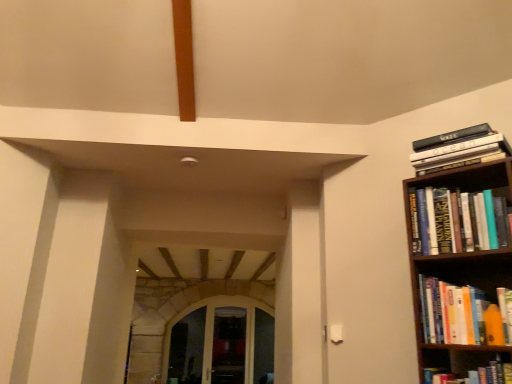
Where is `hardcover book at upper right, the second book in the top-to-bottom sequence`? Image resolution: width=512 pixels, height=384 pixels. hardcover book at upper right, the second book in the top-to-bottom sequence is located at coordinates (456, 221).

Image resolution: width=512 pixels, height=384 pixels. Describe the element at coordinates (456, 221) in the screenshot. I see `hardcover book at upper right, the second book in the top-to-bottom sequence` at that location.

Identify the location of clear glass door at center, which is the 2th glass door in right-to-left order. This screenshot has height=384, width=512. (212, 330).

The width and height of the screenshot is (512, 384). What do you see at coordinates (473, 375) in the screenshot?
I see `hardcover book at right, which is counted as the fourth book, starting from the top` at bounding box center [473, 375].

Where is `hardcover book at upper right, the second book in the top-to-bottom sequence`? The height and width of the screenshot is (384, 512). hardcover book at upper right, the second book in the top-to-bottom sequence is located at coordinates (456, 221).

This screenshot has height=384, width=512. Identify the location of the 1st book below the hardcover books at upper right, marked as the 4th book in a bottom-to-top arrangement (from the image's perspective). (456, 221).

Between hardcover book at upper right, which ranks as the 3th book in bottom-to-top order, and hardcover books at upper right, marked as the 4th book in a bottom-to-top arrangement, which one has larger size?

With larger size is hardcover books at upper right, marked as the 4th book in a bottom-to-top arrangement.

Is hardcover book at upper right, which ranks as the 3th book in bottom-to-top order, thinner than hardcover books at upper right, marked as the 4th book in a bottom-to-top arrangement?

Indeed, hardcover book at upper right, which ranks as the 3th book in bottom-to-top order, has a lesser width compared to hardcover books at upper right, marked as the 4th book in a bottom-to-top arrangement.

Are hardcover book at upper right, the second book in the top-to-bottom sequence, and hardcover books at upper right, positioned as the 1th book in top-to-bottom order, far apart?

No, there isn't a large distance between hardcover book at upper right, the second book in the top-to-bottom sequence, and hardcover books at upper right, positioned as the 1th book in top-to-bottom order.

Can you confirm if hardcover book at upper right, the second book in the top-to-bottom sequence, is shorter than hardcover book at right, which is counted as the fourth book, starting from the top?

In fact, hardcover book at upper right, the second book in the top-to-bottom sequence, may be taller than hardcover book at right, which is counted as the fourth book, starting from the top.

Relative to hardcover book at right, which is counted as the fourth book, starting from the top, is hardcover book at upper right, the second book in the top-to-bottom sequence, in front or behind?

Visually, hardcover book at upper right, the second book in the top-to-bottom sequence, is located behind hardcover book at right, which is counted as the fourth book, starting from the top.

Is hardcover book at upper right, the second book in the top-to-bottom sequence, facing towards hardcover book at right, arranged as the first book when ordered from the bottom?

No.

In the scene shown: Does hardcover books at upper right, positioned as the 1th book in top-to-bottom order, have a lesser width compared to transparent glass door at center, acting as the first glass door starting from the right?

No, hardcover books at upper right, positioned as the 1th book in top-to-bottom order, is not thinner than transparent glass door at center, acting as the first glass door starting from the right.

Looking at this image, considering the sizes of objects hardcover books at upper right, positioned as the 1th book in top-to-bottom order, and transparent glass door at center, which ranks as the second glass door in left-to-right order, in the image provided, who is bigger, hardcover books at upper right, positioned as the 1th book in top-to-bottom order, or transparent glass door at center, which ranks as the second glass door in left-to-right order,?

transparent glass door at center, which ranks as the second glass door in left-to-right order, is bigger.

From a real-world perspective, is hardcover books at upper right, marked as the 4th book in a bottom-to-top arrangement, positioned over transparent glass door at center, which ranks as the second glass door in left-to-right order, based on gravity?

Correct, in the physical world, hardcover books at upper right, marked as the 4th book in a bottom-to-top arrangement, is higher than transparent glass door at center, which ranks as the second glass door in left-to-right order.

From the image's perspective, is hardcover books at upper right, positioned as the 1th book in top-to-bottom order, on transparent glass door at center, which ranks as the second glass door in left-to-right order?

Yes, from the image's perspective, hardcover books at upper right, positioned as the 1th book in top-to-bottom order, is over transparent glass door at center, which ranks as the second glass door in left-to-right order.

Could you tell me if orange matte bookshelf at right, the 2th book ordered from the bottom, is facing hardcover book at upper right, which ranks as the 3th book in bottom-to-top order?

No, orange matte bookshelf at right, the 2th book ordered from the bottom, is not oriented towards hardcover book at upper right, which ranks as the 3th book in bottom-to-top order.

Which object is further away from the camera taking this photo, orange matte bookshelf at right, the 2th book ordered from the bottom, or hardcover book at upper right, which ranks as the 3th book in bottom-to-top order?

hardcover book at upper right, which ranks as the 3th book in bottom-to-top order, is further from the camera.

Find the location of `the 1st book positioned above the orange matte bookshelf at right, which is the 3th book in top-to-bottom order (from a real-world perspective)`. the 1st book positioned above the orange matte bookshelf at right, which is the 3th book in top-to-bottom order (from a real-world perspective) is located at coordinates point(456,221).

Which is correct: orange matte bookshelf at right, which is the 3th book in top-to-bottom order, is inside hardcover book at upper right, which ranks as the 3th book in bottom-to-top order, or outside of it?

orange matte bookshelf at right, which is the 3th book in top-to-bottom order, exists outside the volume of hardcover book at upper right, which ranks as the 3th book in bottom-to-top order.

Is clear glass door at center, which is the 2th glass door in right-to-left order, further to the viewer compared to orange matte bookshelf at right, which is the 3th book in top-to-bottom order?

Yes.

Is point (164, 382) farther from viewer compared to point (439, 325)?

Yes, it is.

Which of these two, clear glass door at center, the first glass door positioned from the left, or orange matte bookshelf at right, the 2th book ordered from the bottom, is bigger?

clear glass door at center, the first glass door positioned from the left, is bigger.

Is clear glass door at center, which is the 2th glass door in right-to-left order, aimed at orange matte bookshelf at right, which is the 3th book in top-to-bottom order?

Yes, clear glass door at center, which is the 2th glass door in right-to-left order, is turned towards orange matte bookshelf at right, which is the 3th book in top-to-bottom order.

Considering the relative positions of orange matte bookshelf at right, which is the 3th book in top-to-bottom order, and hardcover book at right, which is counted as the fourth book, starting from the top, in the image provided, is orange matte bookshelf at right, which is the 3th book in top-to-bottom order, to the left or to the right of hardcover book at right, which is counted as the fourth book, starting from the top,?

orange matte bookshelf at right, which is the 3th book in top-to-bottom order, is positioned on hardcover book at right, which is counted as the fourth book, starting from the top,'s right side.

From a real-world perspective, is orange matte bookshelf at right, which is the 3th book in top-to-bottom order, physically above hardcover book at right, arranged as the first book when ordered from the bottom?

Yes.

Would you say orange matte bookshelf at right, which is the 3th book in top-to-bottom order, is outside hardcover book at right, arranged as the first book when ordered from the bottom?

Yes, orange matte bookshelf at right, which is the 3th book in top-to-bottom order, is not within hardcover book at right, arranged as the first book when ordered from the bottom.

What's the angular difference between orange matte bookshelf at right, which is the 3th book in top-to-bottom order, and hardcover book at right, arranged as the first book when ordered from the bottom,'s facing directions?

2.74 degrees.

Does point (251, 302) lie behind point (428, 373)?

Yes, it is.

Is clear glass door at center, the first glass door positioned from the left, wider or thinner than hardcover book at right, which is counted as the fourth book, starting from the top?

Considering their sizes, clear glass door at center, the first glass door positioned from the left, looks slimmer than hardcover book at right, which is counted as the fourth book, starting from the top.

Considering the positions of objects clear glass door at center, the first glass door positioned from the left, and hardcover book at right, arranged as the first book when ordered from the bottom, in the image provided, who is more to the right, clear glass door at center, the first glass door positioned from the left, or hardcover book at right, arranged as the first book when ordered from the bottom,?

hardcover book at right, arranged as the first book when ordered from the bottom, is more to the right.

From the image's perspective, is clear glass door at center, the first glass door positioned from the left, on hardcover book at right, which is counted as the fourth book, starting from the top?

No, from the image's perspective, clear glass door at center, the first glass door positioned from the left, is not above hardcover book at right, which is counted as the fourth book, starting from the top.

Identify the location of the 1st book below the hardcover books at upper right, marked as the 4th book in a bottom-to-top arrangement (from the image's perspective). (x=456, y=221).

This screenshot has width=512, height=384. There is a hardcover book at right, arranged as the first book when ordered from the bottom. Find the location of `the 2nd book above it (from a real-world perspective)`. the 2nd book above it (from a real-world perspective) is located at coordinates (456, 221).

From the image, which object appears to be nearer to clear glass door at center, the first glass door positioned from the left, transparent glass door at center, which ranks as the second glass door in left-to-right order, or hardcover book at right, which is counted as the fourth book, starting from the top?

transparent glass door at center, which ranks as the second glass door in left-to-right order, is closer to clear glass door at center, the first glass door positioned from the left.

Looking at this image, when comparing their distances from hardcover book at right, arranged as the first book when ordered from the bottom, does hardcover books at upper right, positioned as the 1th book in top-to-bottom order, or clear glass door at center, the first glass door positioned from the left, seem further?

clear glass door at center, the first glass door positioned from the left.

Considering their positions, is hardcover book at upper right, the second book in the top-to-bottom sequence, positioned further to transparent glass door at center, which ranks as the second glass door in left-to-right order, than hardcover book at right, which is counted as the fourth book, starting from the top?

hardcover book at upper right, the second book in the top-to-bottom sequence, lies further to transparent glass door at center, which ranks as the second glass door in left-to-right order, than the other object.

When comparing their distances from hardcover book at right, arranged as the first book when ordered from the bottom, does hardcover book at upper right, which ranks as the 3th book in bottom-to-top order, or hardcover books at upper right, positioned as the 1th book in top-to-bottom order, seem closer?

Based on the image, hardcover book at upper right, which ranks as the 3th book in bottom-to-top order, appears to be nearer to hardcover book at right, arranged as the first book when ordered from the bottom.

Looking at the image, which one is located closer to hardcover book at upper right, the second book in the top-to-bottom sequence, clear glass door at center, the first glass door positioned from the left, or hardcover books at upper right, marked as the 4th book in a bottom-to-top arrangement?

Based on the image, hardcover books at upper right, marked as the 4th book in a bottom-to-top arrangement, appears to be nearer to hardcover book at upper right, the second book in the top-to-bottom sequence.

Considering their positions, is orange matte bookshelf at right, the 2th book ordered from the bottom, positioned closer to clear glass door at center, the first glass door positioned from the left, than hardcover books at upper right, marked as the 4th book in a bottom-to-top arrangement?

orange matte bookshelf at right, the 2th book ordered from the bottom.

Based on their spatial positions, is clear glass door at center, which is the 2th glass door in right-to-left order, or hardcover book at upper right, which ranks as the 3th book in bottom-to-top order, further from orange matte bookshelf at right, which is the 3th book in top-to-bottom order?

Based on the image, clear glass door at center, which is the 2th glass door in right-to-left order, appears to be further to orange matte bookshelf at right, which is the 3th book in top-to-bottom order.

Based on their spatial positions, is hardcover book at upper right, the second book in the top-to-bottom sequence, or hardcover books at upper right, positioned as the 1th book in top-to-bottom order, further from clear glass door at center, which is the 2th glass door in right-to-left order?

hardcover books at upper right, positioned as the 1th book in top-to-bottom order, is positioned further to the anchor clear glass door at center, which is the 2th glass door in right-to-left order.

The width and height of the screenshot is (512, 384). Identify the location of book between hardcover book at upper right, which ranks as the 3th book in bottom-to-top order, and clear glass door at center, the first glass door positioned from the left, along the z-axis. (462, 150).

In order to click on glass door located between hardcover book at upper right, which ranks as the 3th book in bottom-to-top order, and transparent glass door at center, which ranks as the second glass door in left-to-right order, in the depth direction in this screenshot , I will do `click(212, 330)`.

At what (x,y) coordinates should I click in order to perform the action: click on glass door between hardcover books at upper right, positioned as the 1th book in top-to-bottom order, and transparent glass door at center, which ranks as the second glass door in left-to-right order, along the z-axis. Please return your answer as a coordinate pair (x, y). The height and width of the screenshot is (384, 512). Looking at the image, I should click on (212, 330).

Find the location of a particular element. The width and height of the screenshot is (512, 384). book between hardcover books at upper right, positioned as the 1th book in top-to-bottom order, and orange matte bookshelf at right, the 2th book ordered from the bottom, vertically is located at coordinates (456, 221).